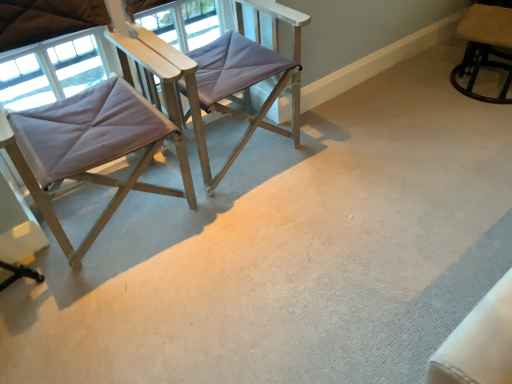
I want to click on space that is in front of beige fabric chair at upper right, the first chair when ordered from right to left, so click(x=479, y=127).